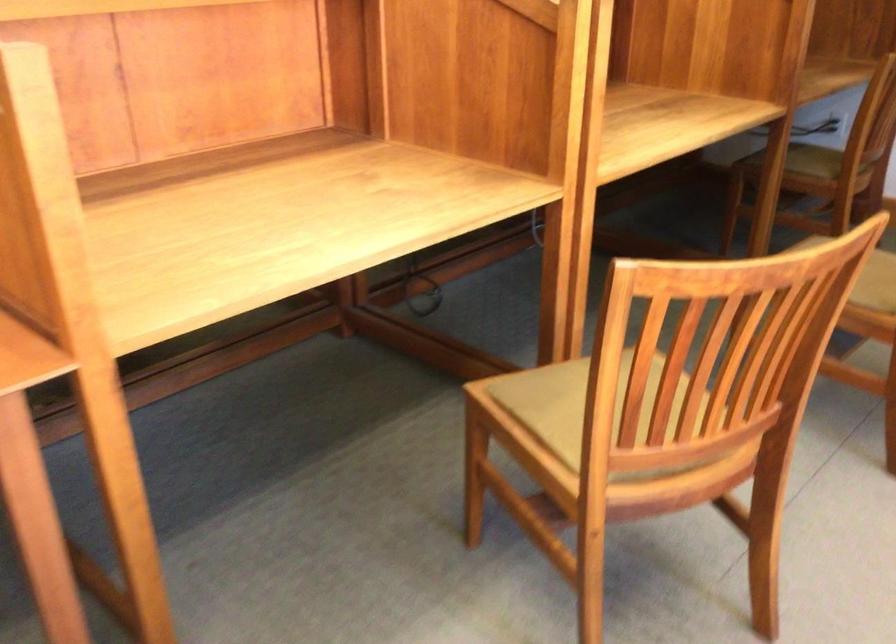
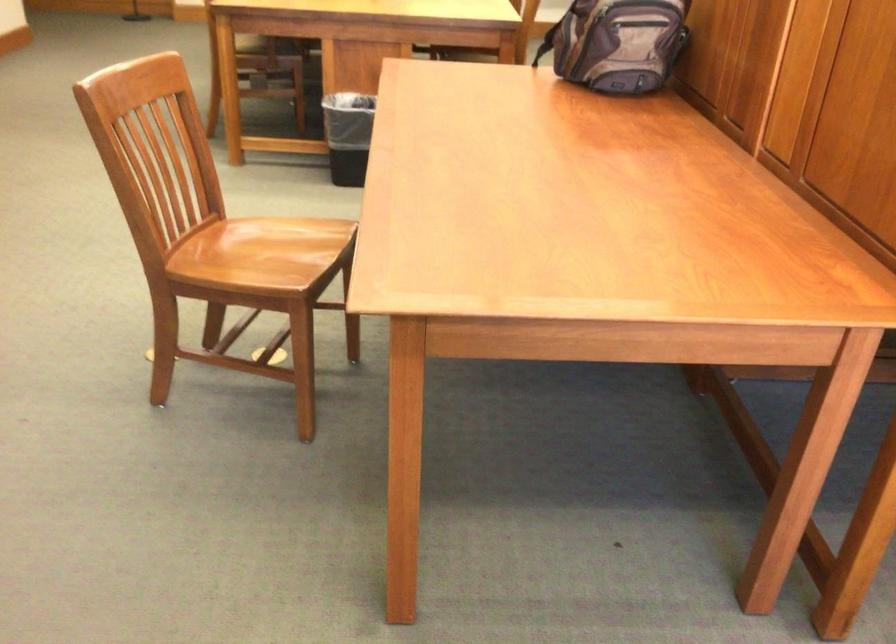
Question: The images are taken continuously from a first-person perspective. In which direction is your viewpoint rotating?

Choices:
 (A) Left
 (B) Right
 (C) Up
 (D) Down

Answer: (A)